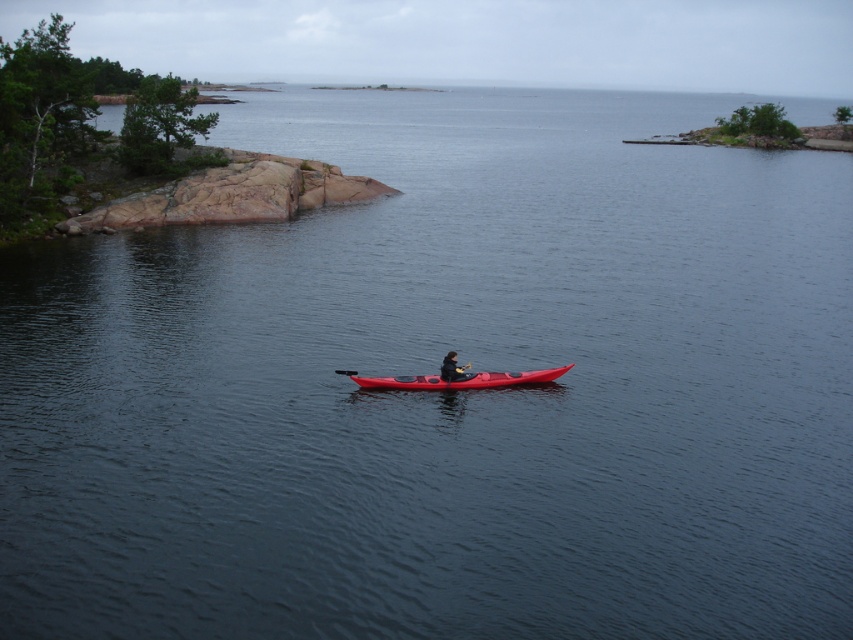
You are navigating a kayak and need to reach a point located at point [497,380]. There is an obstacle at point [451,358]. Based on the scene, can you safely pass behind the obstacle to reach your destination?

Point [497,380] is behind point [451,358], so yes, you can safely navigate behind the obstacle at point [451,358] to reach your destination at point [497,380].

You are planning to store the matte red kayak at center and the dark gray fabric jacket at center in a storage locker. The locker has a width of 1.2 meters. Can both items be placed side by side without overlapping?

The matte red kayak at center is wider than the dark gray fabric jacket at center. Since the kayak is wider, the total combined width of both items may exceed the locker width of 1.2 meters. Check their exact dimensions to confirm.